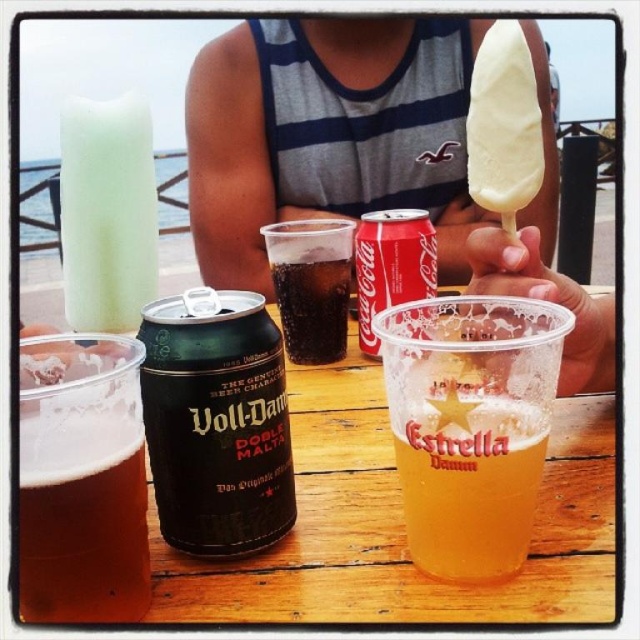
Looking at this image, between brown matte can at lower left and green matte can at center, which one has less height?

With less height is brown matte can at lower left.

What do you see at coordinates (83, 520) in the screenshot? I see `brown matte can at lower left` at bounding box center [83, 520].

Identify the location of brown matte can at lower left. The width and height of the screenshot is (640, 640). (83, 520).

Between black matte can at center and green matte can at center, which one has more height?

green matte can at center is taller.

Does black matte can at center appear under green matte can at center?

Correct, black matte can at center is located below green matte can at center.

Who is more distant from viewer, (156, 371) or (358, 337)?

Positioned behind is point (358, 337).

The width and height of the screenshot is (640, 640). I want to click on black matte can at center, so click(x=216, y=424).

Does black matte can at center have a smaller size compared to brown matte can at lower left?

Actually, black matte can at center might be larger than brown matte can at lower left.

Is black matte can at center positioned behind brown matte can at lower left?

Yes, black matte can at center is further from the viewer.

Measure the distance between point (224, 529) and camera.

A distance of 11.22 inches exists between point (224, 529) and camera.

This screenshot has width=640, height=640. Identify the location of black matte can at center. 216,424.